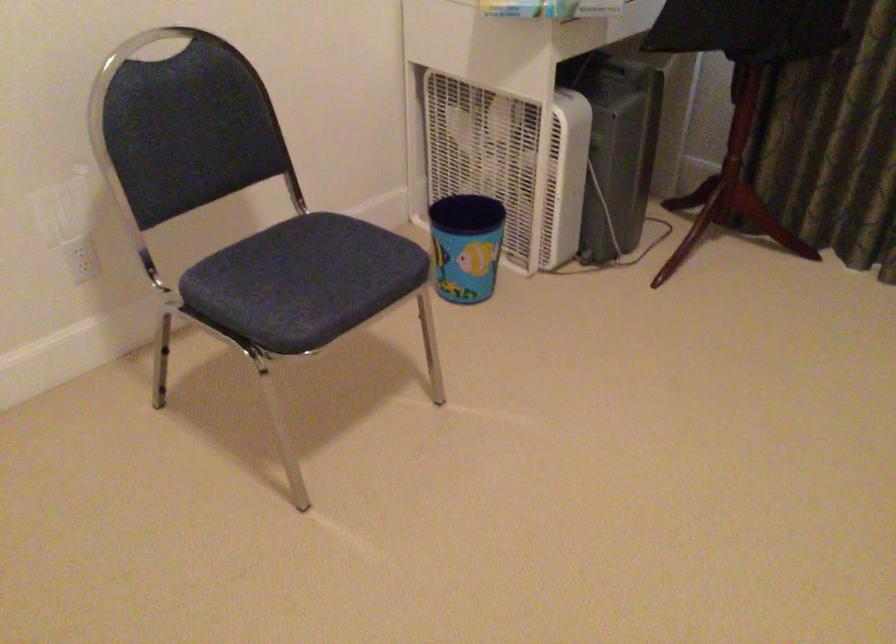
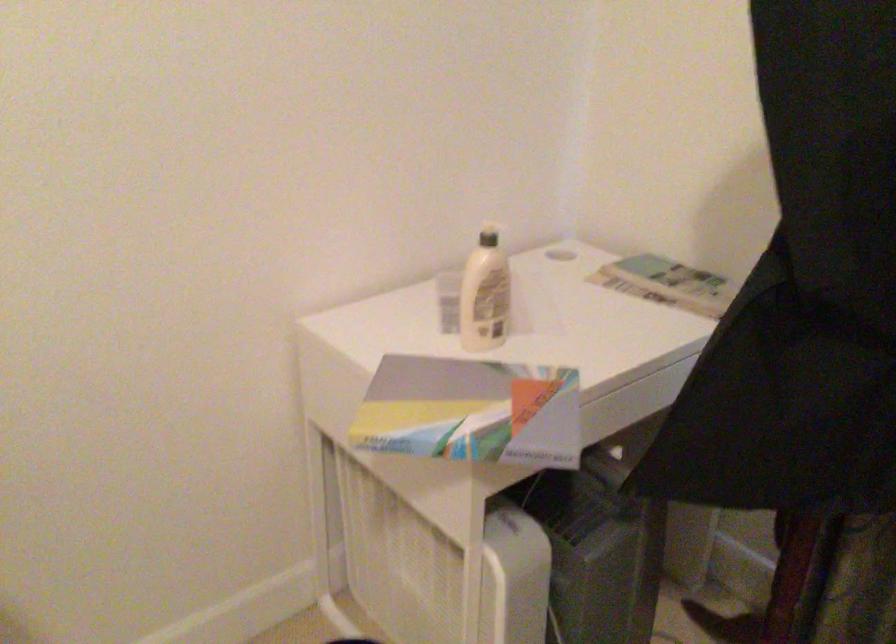
What movement of the cameraman would produce the second image?

The cameraman walked toward right, forward.